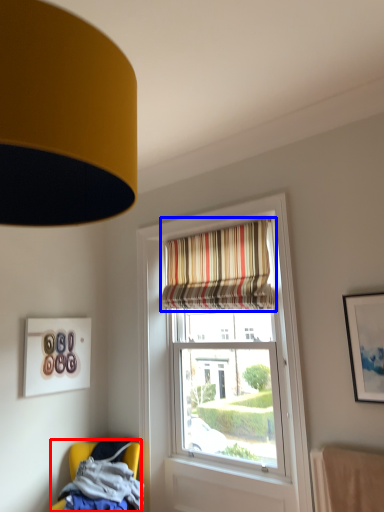
Question: Among these objects, which one is nearest to the camera, chair (highlighted by a red box) or curtain (highlighted by a blue box)?

Choices:
 (A) chair
 (B) curtain

Answer: (A)